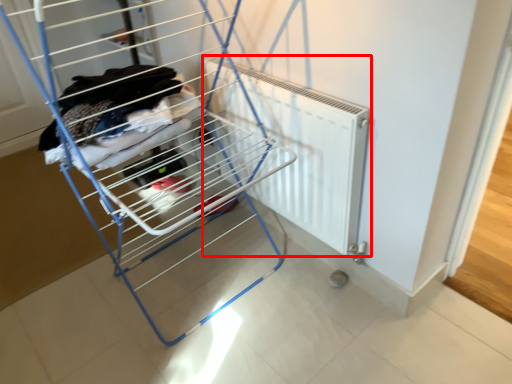
Question: From the image's perspective, what is the correct spatial positioning of radiator (annotated by the red box) in reference to furniture?

Choices:
 (A) below
 (B) above

Answer: (A)